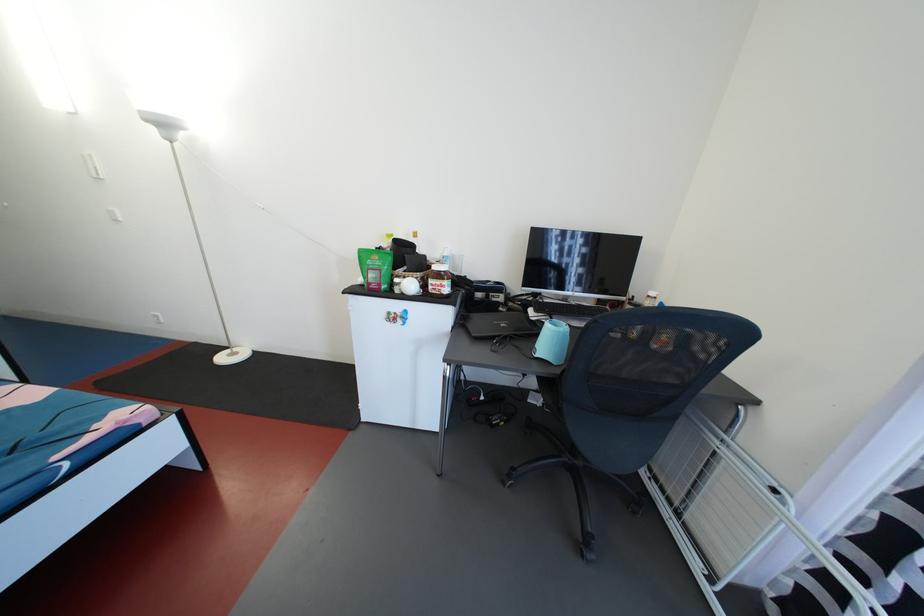
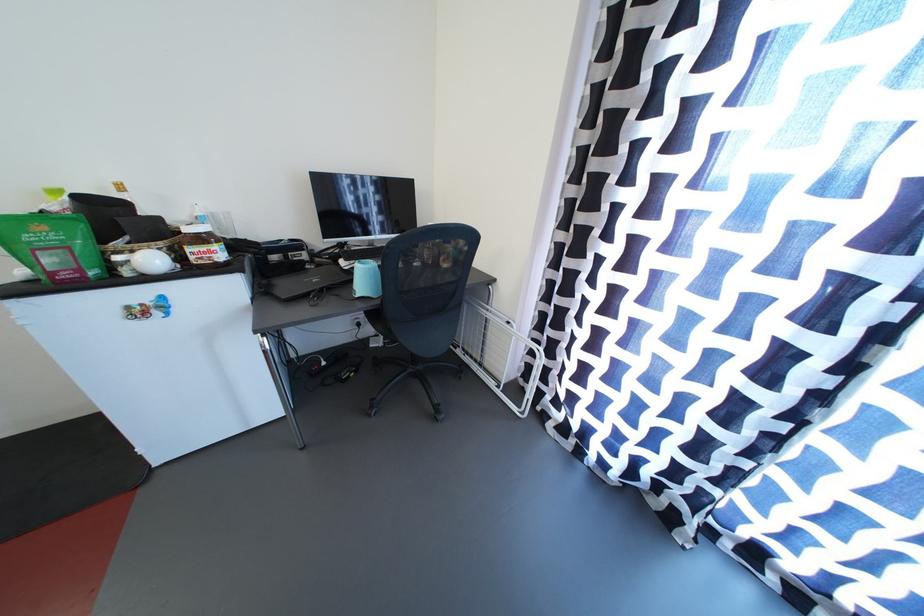
In the second image, find the point that corresponds to (417,290) in the first image.

(157, 265)